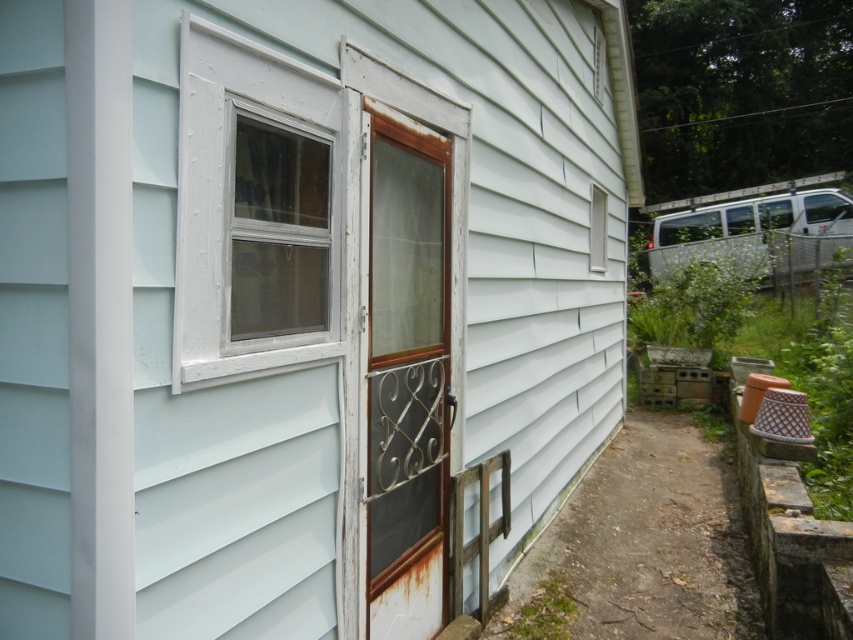
How much distance is there between light blue siding at center and white plastic window at upper left?

light blue siding at center is 17.44 inches away from white plastic window at upper left.

From the picture: Is light blue siding at center smaller than white plastic window at upper left?

Incorrect, light blue siding at center is not smaller in size than white plastic window at upper left.

Which is behind, point (276, 353) or point (193, 160)?

Point (276, 353)

At what (x,y) coordinates should I click in order to perform the action: click on light blue siding at center. Please return your answer as a coordinate pair (x, y). This screenshot has height=640, width=853. Looking at the image, I should click on (299, 301).

Who is more forward, [308,456] or [281,252]?

Point [281,252] is more forward.

Is light blue siding at center closer to the viewer compared to clear glass window at upper left?

Yes, light blue siding at center is closer to the viewer.

Locate an element on the screen. light blue siding at center is located at coordinates (299, 301).

Locate an element on the screen. The image size is (853, 640). light blue siding at center is located at coordinates (299, 301).

Which is more to the left, rusty metal screen door at center or clear glass window at upper left?

Positioned to the left is clear glass window at upper left.

Is point (434, 342) positioned behind point (257, 314)?

Yes, point (434, 342) is behind point (257, 314).

I want to click on rusty metal screen door at center, so click(405, 374).